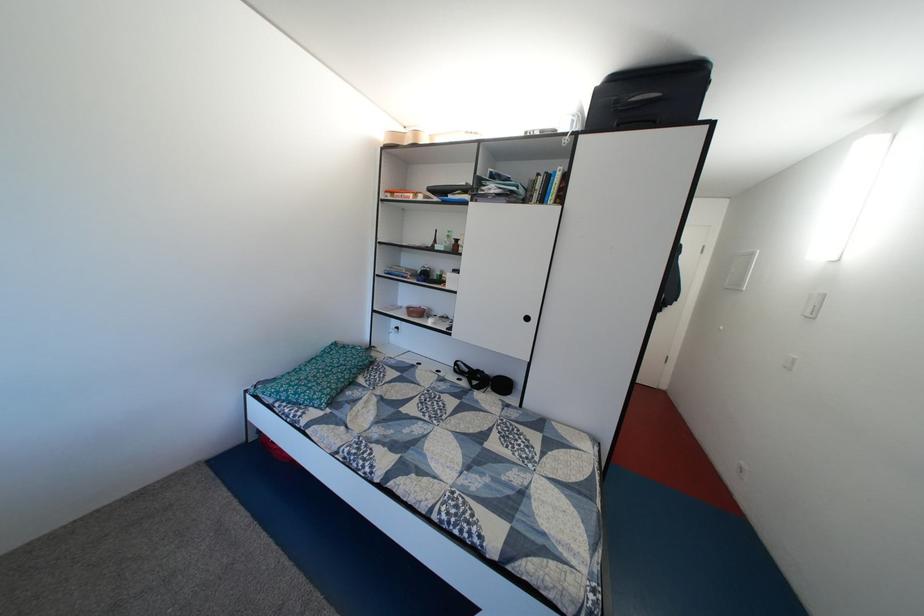
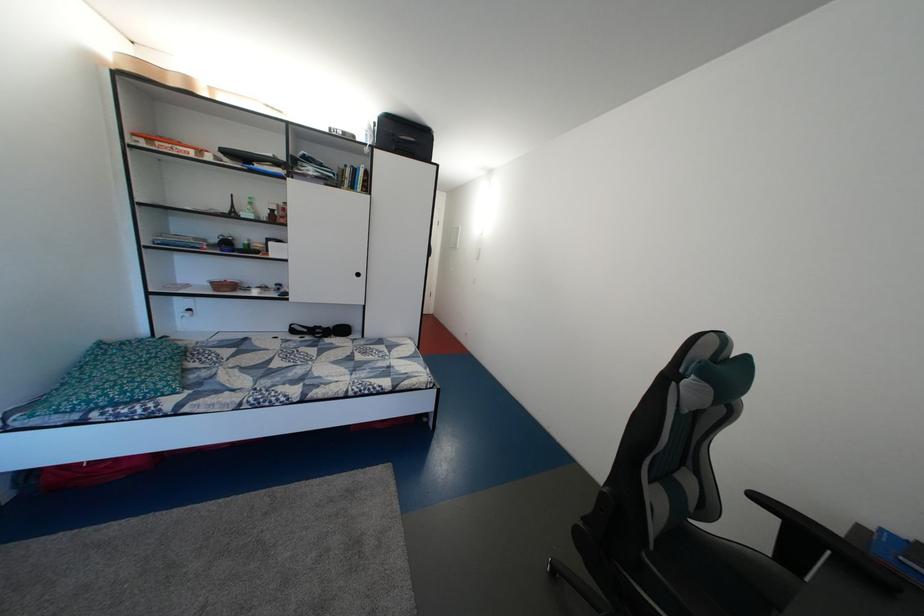
In the second image, find the point that corresponds to [427,310] in the first image.

(228, 284)